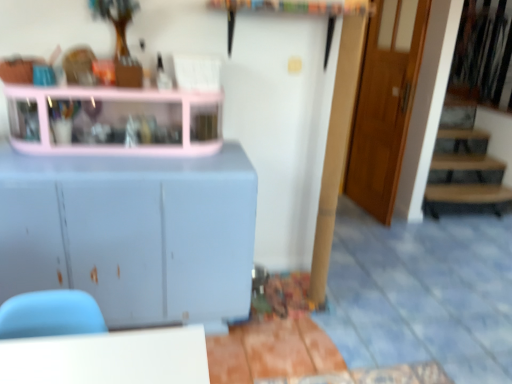
Question: From a real-world perspective, relative to matte white cabinet at left, is wooden door at right vertically above or below?

Choices:
 (A) above
 (B) below

Answer: (A)

Question: Based on their sizes in the image, would you say wooden door at right is bigger or smaller than matte white cabinet at left?

Choices:
 (A) big
 (B) small

Answer: (B)

Question: Estimate the real-world distances between objects in this image. Which object is farther from the matte white cabinet at left?

Choices:
 (A) pink plastic shelf at upper left
 (B) wooden door at right

Answer: (B)

Question: Considering the real-world distances, which object is closest to the pink plastic shelf at upper left?

Choices:
 (A) wooden door at right
 (B) matte white cabinet at left

Answer: (B)